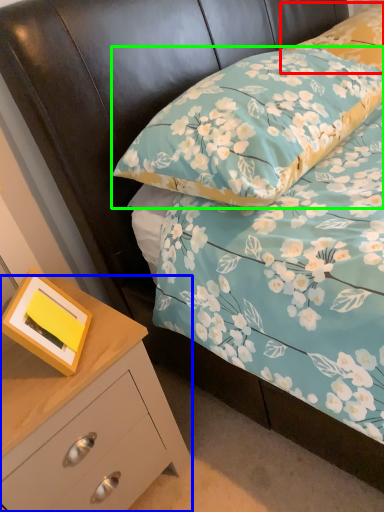
Question: Estimate the real-world distances between objects in this image. Which object is farther from pillow (highlighted by a red box), chest of drawers (highlighted by a blue box) or pillow (highlighted by a green box)?

Choices:
 (A) chest of drawers
 (B) pillow

Answer: (A)